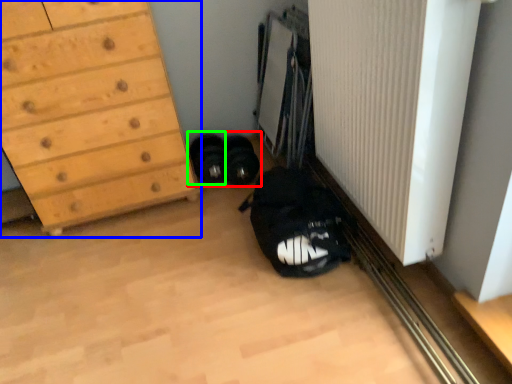
Question: Which object is positioned closest to footwear (highlighted by a red box)? Select from chest of drawers (highlighted by a blue box) and footwear (highlighted by a green box).

Choices:
 (A) chest of drawers
 (B) footwear

Answer: (B)